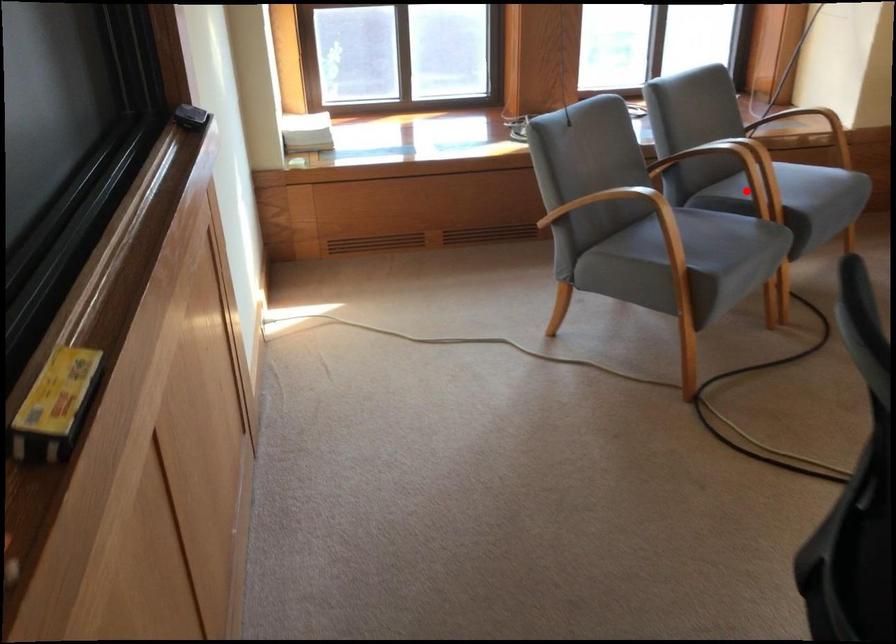
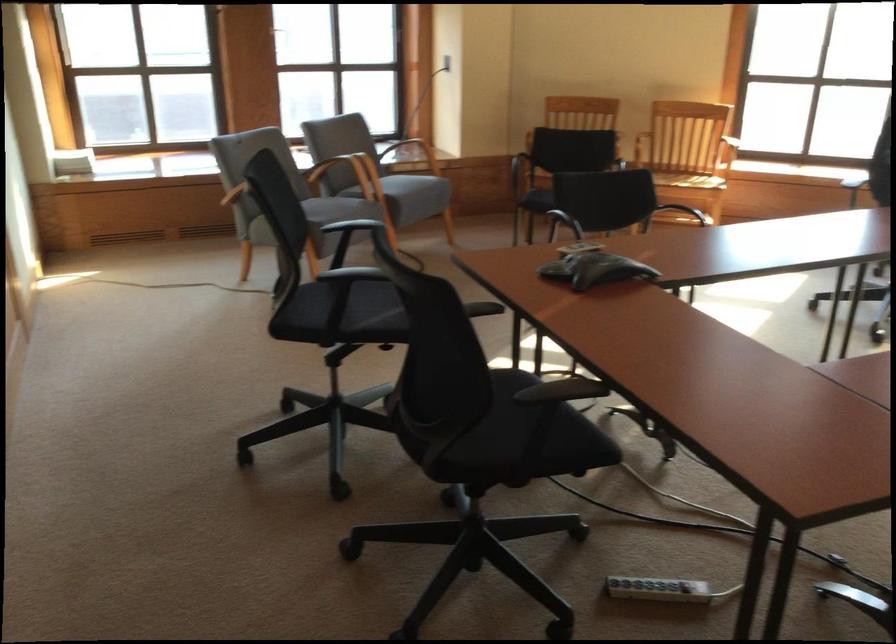
Question: A red point is marked in image1. In image2, is the corresponding 3D point closer to the camera or farther? Reply with the corresponding letter.

Choices:
 (A) The corresponding 3D point is closer.
 (B) The corresponding 3D point is farther.

Answer: (B)